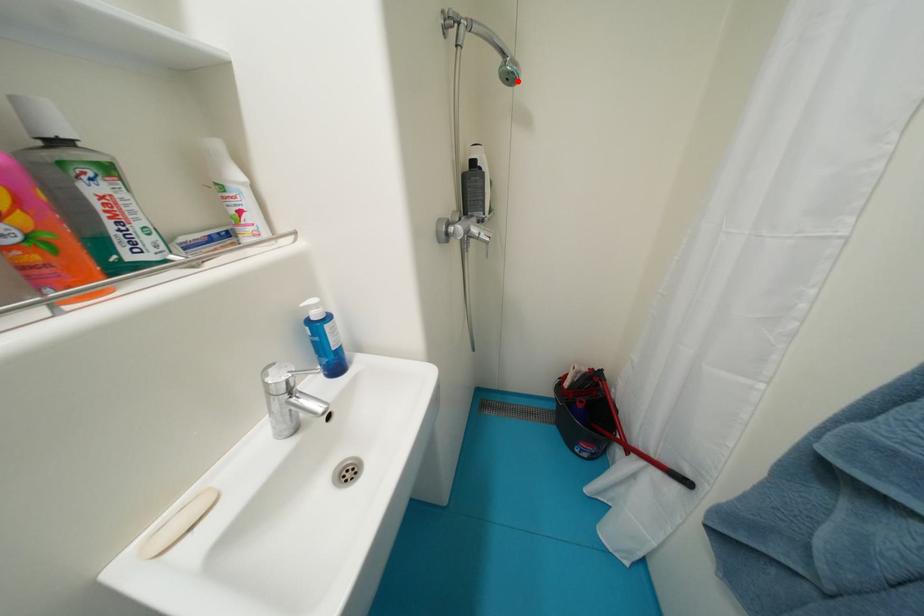
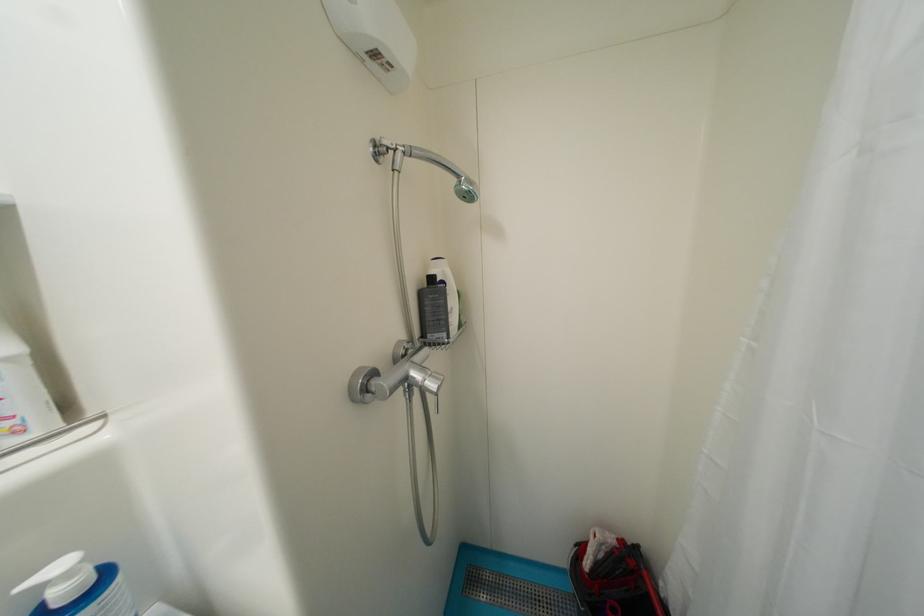
Find the pixel in the second image that matches the highlighted location in the first image.

(476, 199)